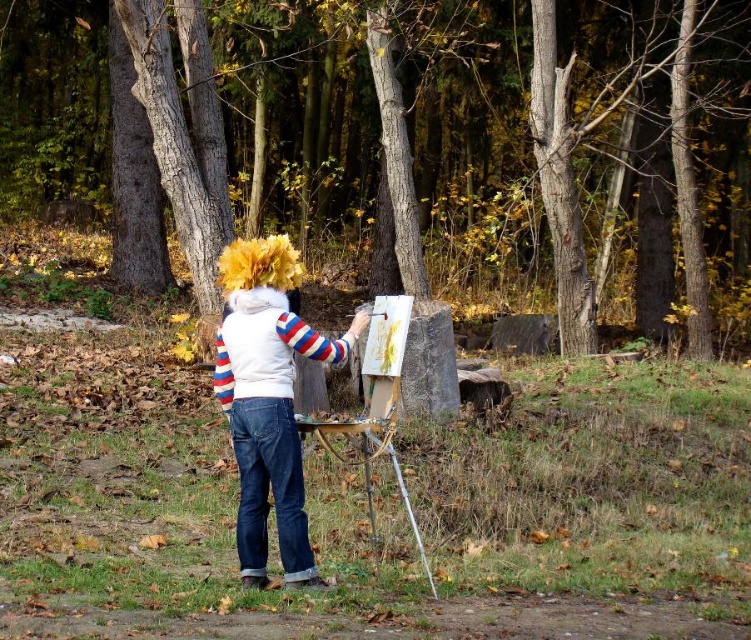
You are an artist trying to set up your painting equipment in the forest. You have a brown textured trunk at center and a metallic silver easel at center. Which object would be more suitable to use as a base to place your small art supplies?

The brown textured trunk at center is larger in size than the metallic silver easel at center, so it would provide a more stable and suitable base for placing small art supplies.

You are a photographer taking a picture of the two points in the scene. Which point, point (593, 1) or point (267, 316), is closer to the camera?

Point (267, 316) is closer to the camera than point (593, 1).

You are an observer standing in front of the scene. You notice the denim jacket at center and the metallic silver easel at center. Which object is taller?

The denim jacket at center is taller than the metallic silver easel at center.